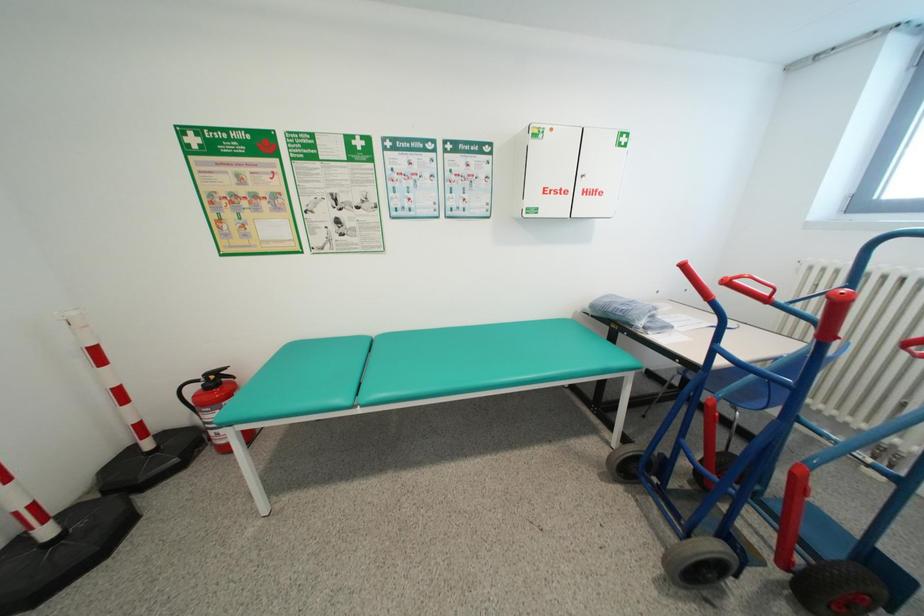
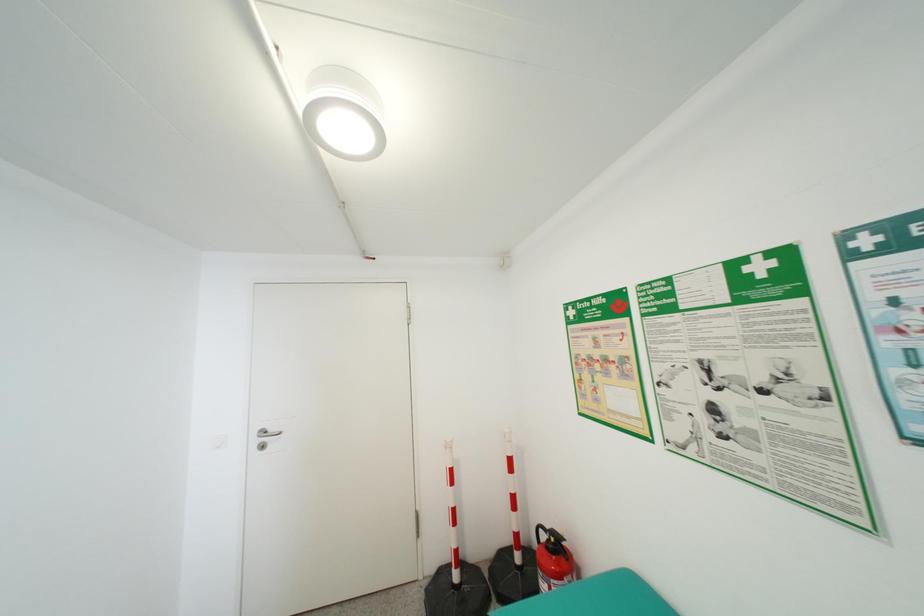
Question: The images are taken continuously from a first-person perspective. In which direction is your viewpoint rotating?

Choices:
 (A) Left
 (B) Right
 (C) Up
 (D) Down

Answer: (A)